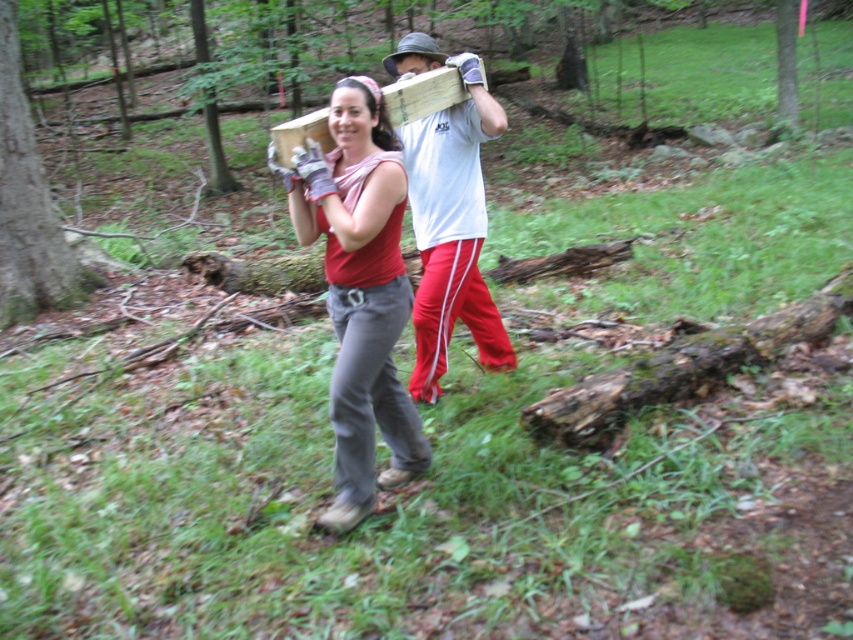
Is matte red tank top at center positioned before white cotton t-shirt at center?

Yes, matte red tank top at center is in front of white cotton t-shirt at center.

Does point (354, 113) lie behind point (428, 154)?

That is False.

Between point (389, 305) and point (424, 170), which one is positioned behind?

Point (424, 170)

The image size is (853, 640). I want to click on matte red tank top at center, so click(358, 291).